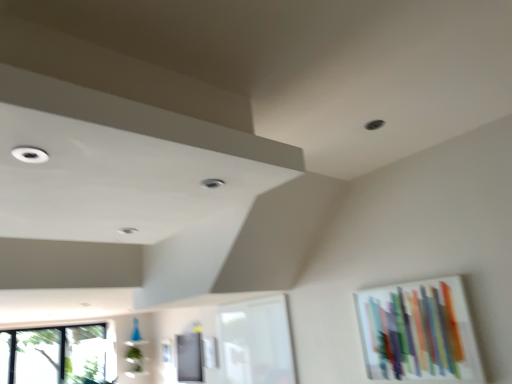
Find the location of a particular element. translucent glass artwork at upper right is located at coordinates coord(418,331).

Identify the location of transparent glass window at lower left. (54, 355).

Is white glass window frame at center facing towards translucent glass artwork at upper right?

No, white glass window frame at center is not oriented towards translucent glass artwork at upper right.

From the image's perspective, is white glass window frame at center located above or below translucent glass artwork at upper right?

white glass window frame at center is below translucent glass artwork at upper right.

This screenshot has height=384, width=512. Identify the location of window frame that is behind the translucent glass artwork at upper right. (256, 342).

Do you think white glass window frame at center is within translucent glass artwork at upper right, or outside of it?

white glass window frame at center exists outside the volume of translucent glass artwork at upper right.

From the picture: Can you tell me how much white glass window frame at center and transparent glass window at lower left differ in facing direction?

The angular difference between white glass window frame at center and transparent glass window at lower left is 91.9 degrees.

Identify the location of window frame that is above the transparent glass window at lower left (from the image's perspective). This screenshot has width=512, height=384. (256, 342).

Looking at this image, is white glass window frame at center oriented towards transparent glass window at lower left?

No, white glass window frame at center does not turn towards transparent glass window at lower left.

From the image's perspective, is white glass window frame at center positioned above or below transparent glass window at lower left?

white glass window frame at center is above transparent glass window at lower left.

How many degrees apart are the facing directions of transparent glass window at lower left and translucent glass artwork at upper right?

The angular difference between transparent glass window at lower left and translucent glass artwork at upper right is 91.4 degrees.

In the scene shown: Is transparent glass window at lower left positioned beyond the bounds of translucent glass artwork at upper right?

Yes, transparent glass window at lower left is not within translucent glass artwork at upper right.

Based on the photo, considering the sizes of objects transparent glass window at lower left and translucent glass artwork at upper right in the image provided, who is thinner, transparent glass window at lower left or translucent glass artwork at upper right?

Thinner between the two is translucent glass artwork at upper right.

Is transparent glass window at lower left beside translucent glass artwork at upper right?

No, transparent glass window at lower left is not making contact with translucent glass artwork at upper right.

Consider the image. Is translucent glass artwork at upper right oriented away from white glass window frame at center?

No, translucent glass artwork at upper right's orientation is not away from white glass window frame at center.

Would you say translucent glass artwork at upper right contains white glass window frame at center?

No, white glass window frame at center is not surrounded by translucent glass artwork at upper right.

Does translucent glass artwork at upper right lie behind white glass window frame at center?

No, translucent glass artwork at upper right is in front of white glass window frame at center.

The image size is (512, 384). In order to click on window frame located below the translucent glass artwork at upper right (from the image's perspective) in this screenshot , I will do `click(256, 342)`.

Considering the relative sizes of transparent glass window at lower left and white glass window frame at center in the image provided, is transparent glass window at lower left smaller than white glass window frame at center?

No.

Consider the image. Is transparent glass window at lower left behind white glass window frame at center?

That is True.

Based on the photo, is transparent glass window at lower left not near white glass window frame at center?

Yes, transparent glass window at lower left and white glass window frame at center are quite far apart.

From a real-world perspective, is transparent glass window at lower left positioned under white glass window frame at center based on gravity?

Correct, in the physical world, transparent glass window at lower left is lower than white glass window frame at center.

From the image's perspective, is translucent glass artwork at upper right located beneath transparent glass window at lower left?

No.

Is translucent glass artwork at upper right thinner than transparent glass window at lower left?

Yes.

Can you confirm if translucent glass artwork at upper right is positioned to the right of transparent glass window at lower left?

Yes.

Does translucent glass artwork at upper right have a larger size compared to transparent glass window at lower left?

No, translucent glass artwork at upper right is not bigger than transparent glass window at lower left.

You are a GUI agent. You are given a task and a screenshot of the screen. Output one action in this format:
    pyautogui.click(x=<x>, y=<y>)
    Task: Click on the window frame below the translucent glass artwork at upper right (from the image's perspective)
    The width and height of the screenshot is (512, 384).
    Given the screenshot: What is the action you would take?
    pyautogui.click(x=256, y=342)

The height and width of the screenshot is (384, 512). I want to click on window frame in front of the transparent glass window at lower left, so click(256, 342).

Estimate the real-world distances between objects in this image. Which object is closer to translucent glass artwork at upper right, transparent glass window at lower left or white glass window frame at center?

white glass window frame at center is closer to translucent glass artwork at upper right.

When comparing their distances from white glass window frame at center, does transparent glass window at lower left or translucent glass artwork at upper right seem further?

transparent glass window at lower left is positioned further to the anchor white glass window frame at center.

Which object lies further to the anchor point white glass window frame at center, translucent glass artwork at upper right or transparent glass window at lower left?

transparent glass window at lower left is further to white glass window frame at center.

From the image, which object appears to be nearer to transparent glass window at lower left, white glass window frame at center or translucent glass artwork at upper right?

white glass window frame at center lies closer to transparent glass window at lower left than the other object.

Looking at the image, which one is located closer to translucent glass artwork at upper right, white glass window frame at center or transparent glass window at lower left?

white glass window frame at center is positioned closer to the anchor translucent glass artwork at upper right.

When comparing their distances from transparent glass window at lower left, does translucent glass artwork at upper right or white glass window frame at center seem closer?

white glass window frame at center.

Where is `window frame between transparent glass window at lower left and translucent glass artwork at upper right`? window frame between transparent glass window at lower left and translucent glass artwork at upper right is located at coordinates (256, 342).